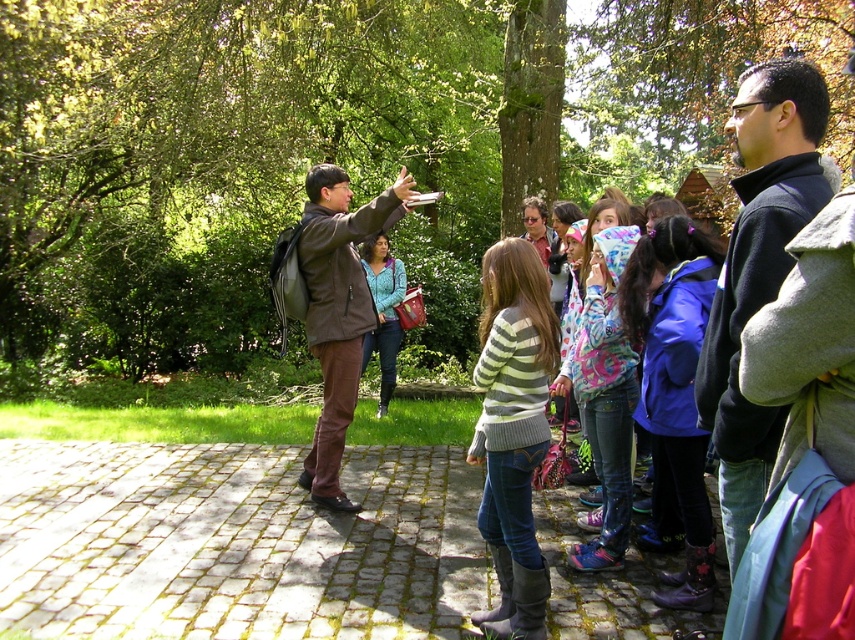
Which is behind, point (95, 216) or point (394, 275)?

Positioned behind is point (95, 216).

Image resolution: width=855 pixels, height=640 pixels. What do you see at coordinates (327, 145) in the screenshot? I see `green leafy tree at center` at bounding box center [327, 145].

Identify the location of green leafy tree at center. (327, 145).

The height and width of the screenshot is (640, 855). I want to click on green leafy tree at center, so click(327, 145).

Who is more distant from viewer, (x=101, y=259) or (x=499, y=316)?

The point (x=101, y=259) is behind.

Based on the photo, is green leafy tree at center shorter than striped sweater at center?

In fact, green leafy tree at center may be taller than striped sweater at center.

Find the location of a particular element. green leafy tree at center is located at coordinates (327, 145).

Between dark blue fleece jacket at center and striped sweater at center, which one has less height?

dark blue fleece jacket at center

The height and width of the screenshot is (640, 855). What do you see at coordinates (758, 272) in the screenshot?
I see `dark blue fleece jacket at center` at bounding box center [758, 272].

Which is behind, point (805, 180) or point (494, 472)?

The point (494, 472) is behind.

Where is `dark blue fleece jacket at center`? The image size is (855, 640). dark blue fleece jacket at center is located at coordinates (758, 272).